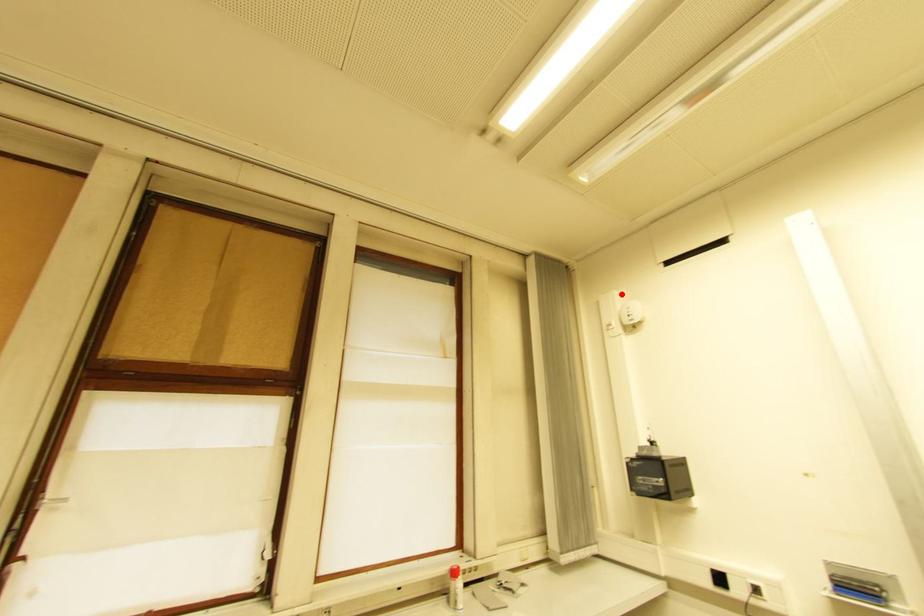
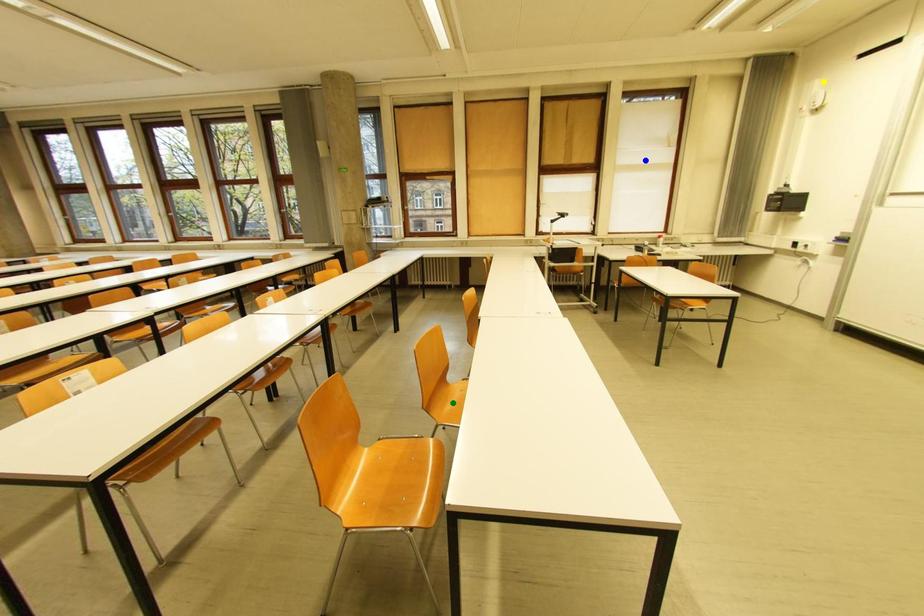
Question: I am providing you with two images of the same scene from different viewpoints. A red point is marked on the first image. You are given multiple points on the second image. Which mark in image 2 goes with the point in image 1?

Choices:
 (A) yellow point
 (B) green point
 (C) blue point

Answer: (A)